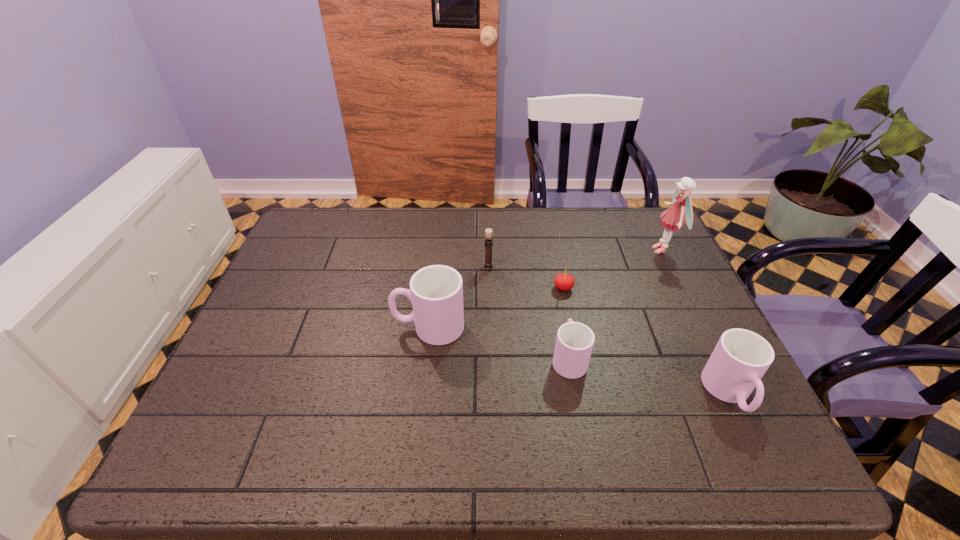
Locate an element on the screen. Image resolution: width=960 pixels, height=540 pixels. cup present at the right edge is located at coordinates pos(741,357).

You are a GUI agent. You are given a task and a screenshot of the screen. Output one action in this format:
    pyautogui.click(x=<x>, y=<y>)
    Task: Click on the doll present at the right edge
    This screenshot has height=540, width=960.
    Given the screenshot: What is the action you would take?
    pyautogui.click(x=673, y=218)

Identify the location of object positioned at the far right corner. Image resolution: width=960 pixels, height=540 pixels. (673, 218).

Where is `object present at the near right corner`? The image size is (960, 540). object present at the near right corner is located at coordinates (741, 357).

In the image, there is a desktop. Where is `vacant space at the far edge`? The width and height of the screenshot is (960, 540). vacant space at the far edge is located at coordinates (564, 213).

This screenshot has width=960, height=540. I want to click on vacant space at the left edge, so click(x=229, y=376).

The width and height of the screenshot is (960, 540). What are the coordinates of `free space at the right edge of the desktop` in the screenshot? It's located at (661, 282).

Locate an element on the screen. The width and height of the screenshot is (960, 540). free point at the far left corner is located at coordinates (329, 216).

Locate an element on the screen. vacant space at the near left corner of the desktop is located at coordinates (286, 390).

Find the location of a particular element. This screenshot has height=540, width=960. free space at the far right corner is located at coordinates point(653,220).